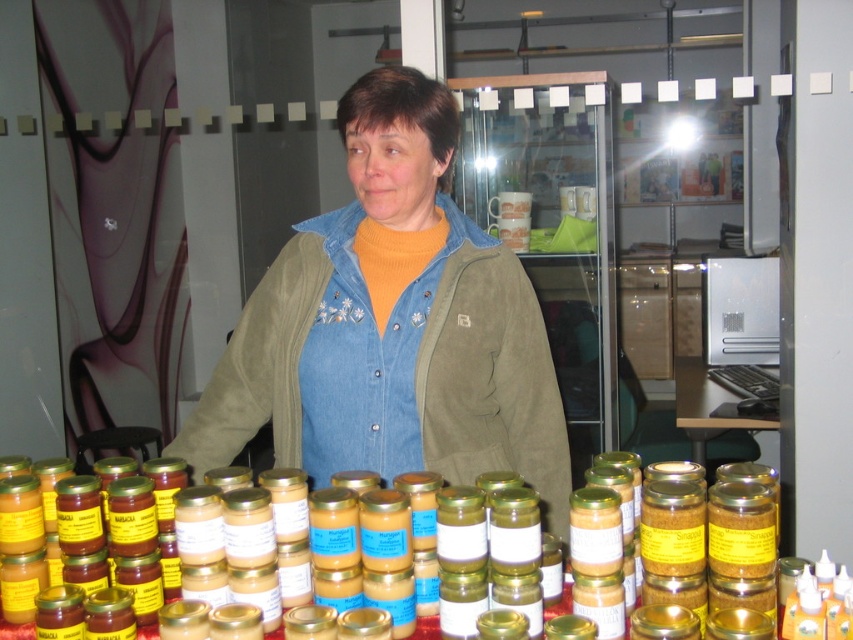
Question: Is denim jacket at center bigger than clear plastic table at center?

Choices:
 (A) no
 (B) yes

Answer: (A)

Question: Which of the following is the farthest from the observer?

Choices:
 (A) clear plastic table at center
 (B) denim jacket at center

Answer: (A)

Question: Is denim jacket at center thinner than clear plastic table at center?

Choices:
 (A) yes
 (B) no

Answer: (B)

Question: Which of the following is the farthest from the observer?

Choices:
 (A) clear plastic table at center
 (B) denim jacket at center

Answer: (A)

Question: Does denim jacket at center have a larger size compared to clear plastic table at center?

Choices:
 (A) yes
 (B) no

Answer: (B)